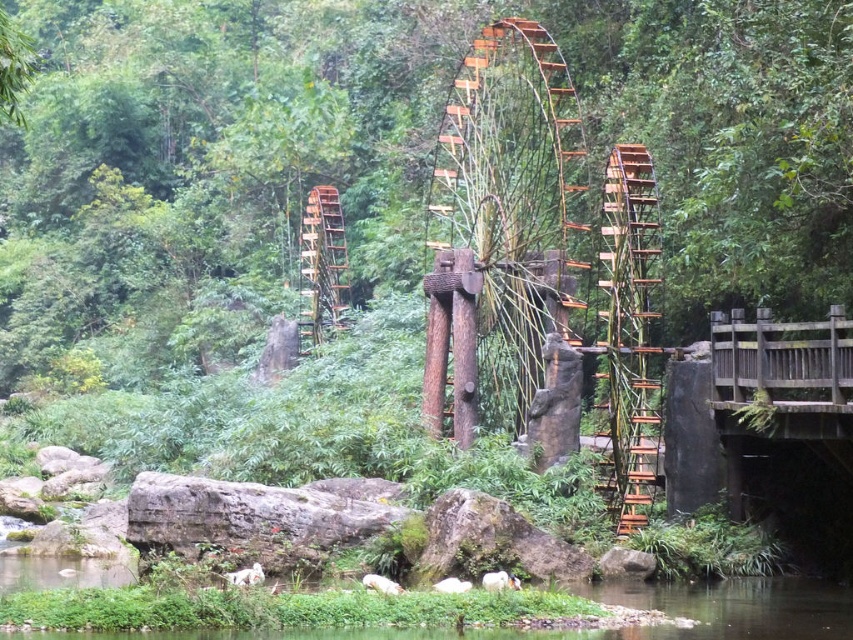
Is wooden bridge at right to the right of rustic wood wheel at center from the viewer's perspective?

Yes, wooden bridge at right is to the right of rustic wood wheel at center.

How much distance is there between wooden bridge at right and rustic wood wheel at center?

wooden bridge at right is 44.81 meters from rustic wood wheel at center.

What do you see at coordinates (782, 372) in the screenshot?
I see `wooden bridge at right` at bounding box center [782, 372].

Where is `wooden bridge at right`? wooden bridge at right is located at coordinates (782, 372).

Is wooden waterwheel at center-right wider than wooden bridge at right?

In fact, wooden waterwheel at center-right might be narrower than wooden bridge at right.

Which is behind, point (636, 381) or point (844, 401)?

The point (636, 381) is behind.

Find the location of a particular element. The width and height of the screenshot is (853, 640). wooden waterwheel at center-right is located at coordinates (631, 326).

Between point (468, 401) and point (607, 266), which one is positioned in front?

Positioned in front is point (607, 266).

This screenshot has height=640, width=853. I want to click on wooden waterwheel at center, so click(x=502, y=228).